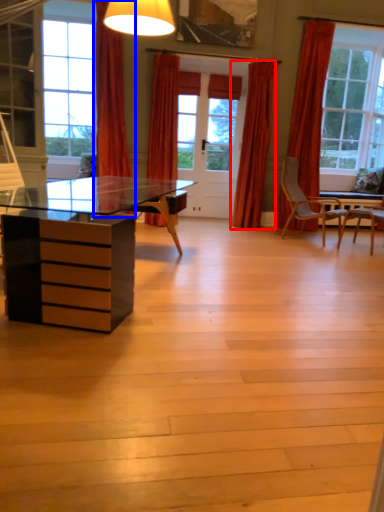
Question: Which object is closer to the camera taking this photo, curtain (highlighted by a red box) or curtain (highlighted by a blue box)?

Choices:
 (A) curtain
 (B) curtain

Answer: (B)